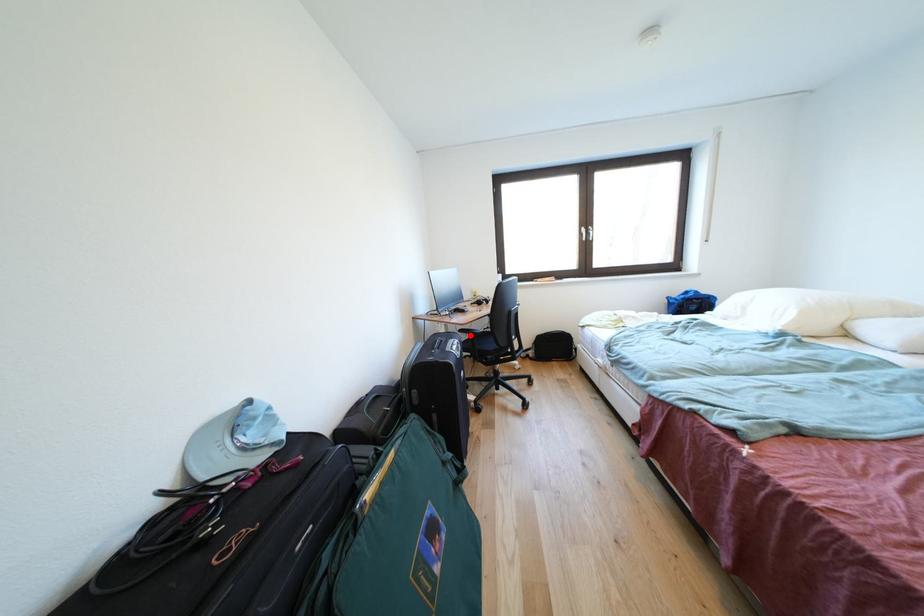
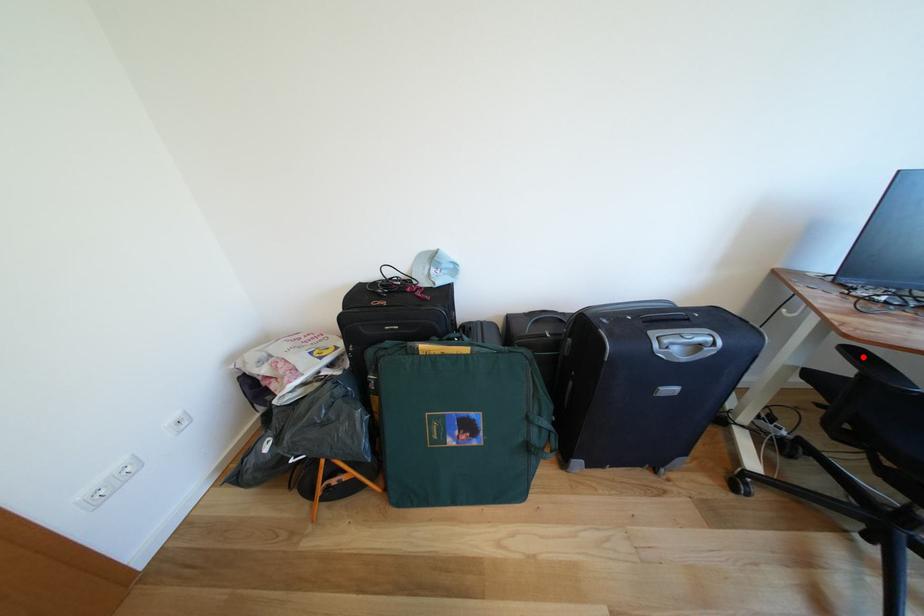
I am providing you with two images of the same scene from different viewpoints. A red point is marked on the first image and another point is marked on the second image. Do the highlighted points in image1 and image2 indicate the same real-world spot?

Yes